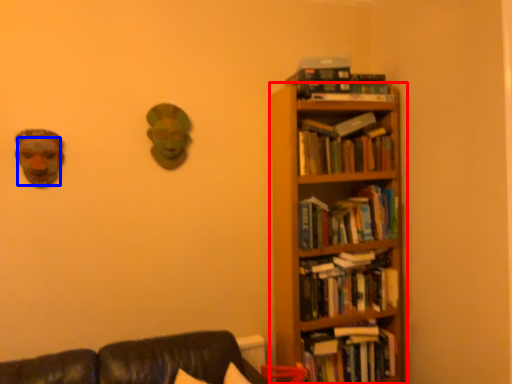
Question: Which point is further to the camera, bookcase (highlighted by a red box) or human face (highlighted by a blue box)?

Choices:
 (A) bookcase
 (B) human face

Answer: (A)